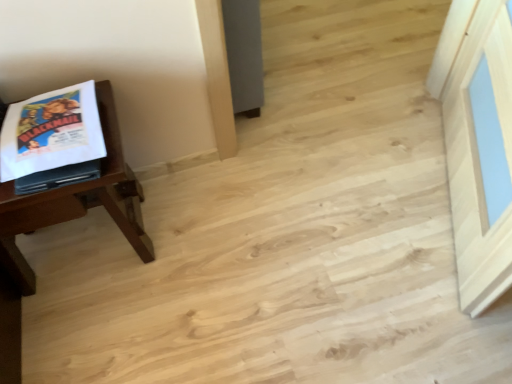
Question: Is point (136, 228) closer or farther from the camera than point (61, 155)?

Choices:
 (A) closer
 (B) farther

Answer: (B)

Question: Is wooden table at left bigger or smaller than white paper comic book at left?

Choices:
 (A) big
 (B) small

Answer: (A)

Question: From a real-world perspective, relative to white paper comic book at left, is wooden table at left vertically above or below?

Choices:
 (A) below
 (B) above

Answer: (A)

Question: From the image's perspective, is white paper comic book at left above or below wooden table at left?

Choices:
 (A) above
 (B) below

Answer: (A)

Question: From a real-world perspective, is white paper comic book at left physically located above or below wooden table at left?

Choices:
 (A) below
 (B) above

Answer: (B)

Question: Is white paper comic book at left in front of or behind wooden table at left in the image?

Choices:
 (A) front
 (B) behind

Answer: (B)

Question: Is point (97, 148) closer or farther from the camera than point (27, 264)?

Choices:
 (A) closer
 (B) farther

Answer: (A)